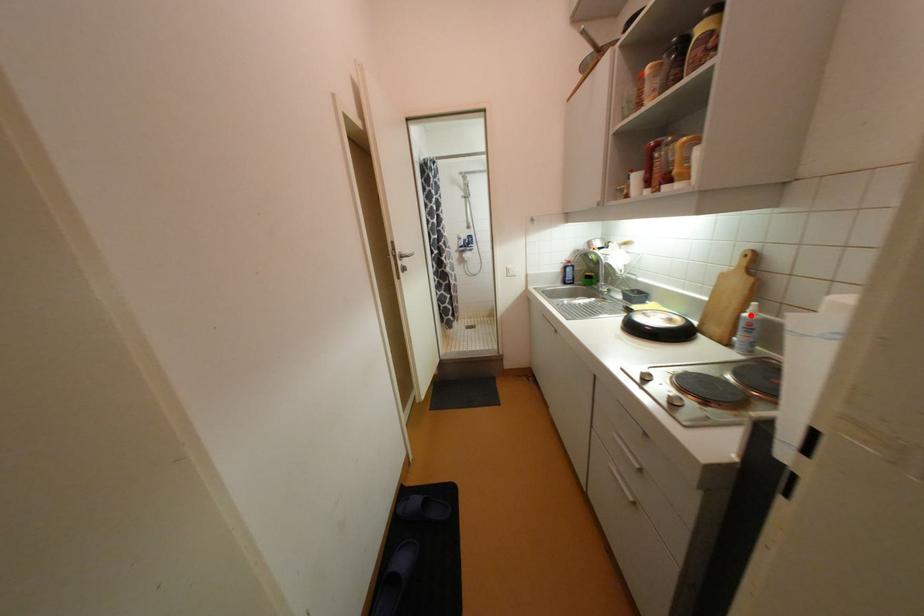
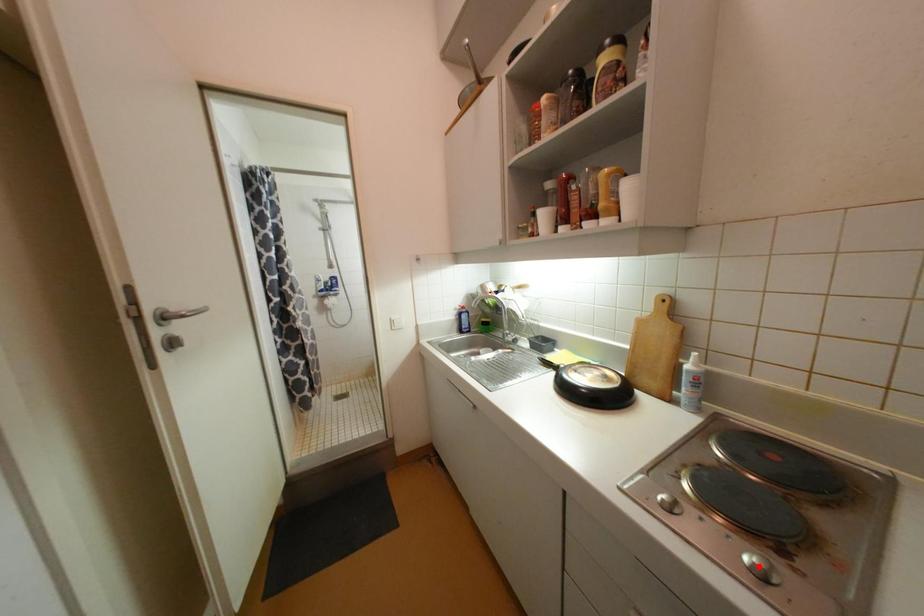
I am providing you with two images of the same scene from different viewpoints. A red point is marked on the first image and another point is marked on the second image. Is the marked point in image1 the same physical position as the marked point in image2?

No